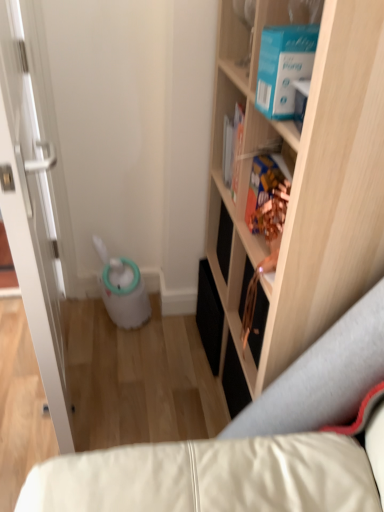
Question: Does light wood cabinet at upper right have a larger size compared to multicolored cardboard book at upper right?

Choices:
 (A) yes
 (B) no

Answer: (A)

Question: Is the depth of light wood cabinet at upper right less than that of multicolored cardboard book at upper right?

Choices:
 (A) no
 (B) yes

Answer: (B)

Question: Is light wood cabinet at upper right located outside multicolored cardboard book at upper right?

Choices:
 (A) yes
 (B) no

Answer: (A)

Question: Is light wood cabinet at upper right far away from multicolored cardboard book at upper right?

Choices:
 (A) yes
 (B) no

Answer: (B)

Question: Is light wood cabinet at upper right surrounding multicolored cardboard book at upper right?

Choices:
 (A) no
 (B) yes

Answer: (B)

Question: From the image's perspective, relative to light wood cabinet at upper right, is white glossy door at left above or below?

Choices:
 (A) above
 (B) below

Answer: (A)

Question: Relative to light wood cabinet at upper right, is white glossy door at left in front or behind?

Choices:
 (A) behind
 (B) front

Answer: (A)

Question: Considering the positions of white glossy door at left and light wood cabinet at upper right in the image, is white glossy door at left wider or thinner than light wood cabinet at upper right?

Choices:
 (A) wide
 (B) thin

Answer: (B)

Question: Is point (41, 93) positioned closer to the camera than point (370, 167)?

Choices:
 (A) farther
 (B) closer

Answer: (A)

Question: Looking at the image, does light wood cabinet at upper right seem bigger or smaller compared to multicolored cardboard book at upper right?

Choices:
 (A) big
 (B) small

Answer: (A)

Question: Considering the positions of light wood cabinet at upper right and multicolored cardboard book at upper right in the image, is light wood cabinet at upper right taller or shorter than multicolored cardboard book at upper right?

Choices:
 (A) short
 (B) tall

Answer: (B)

Question: From a real-world perspective, relative to multicolored cardboard book at upper right, is light wood cabinet at upper right vertically above or below?

Choices:
 (A) below
 (B) above

Answer: (A)

Question: Do you think light wood cabinet at upper right is within multicolored cardboard book at upper right, or outside of it?

Choices:
 (A) outside
 (B) inside

Answer: (A)

Question: In terms of size, does multicolored cardboard book at upper right appear bigger or smaller than white glossy door at left?

Choices:
 (A) small
 (B) big

Answer: (A)

Question: Considering their positions, is multicolored cardboard book at upper right located in front of or behind white glossy door at left?

Choices:
 (A) behind
 (B) front

Answer: (A)